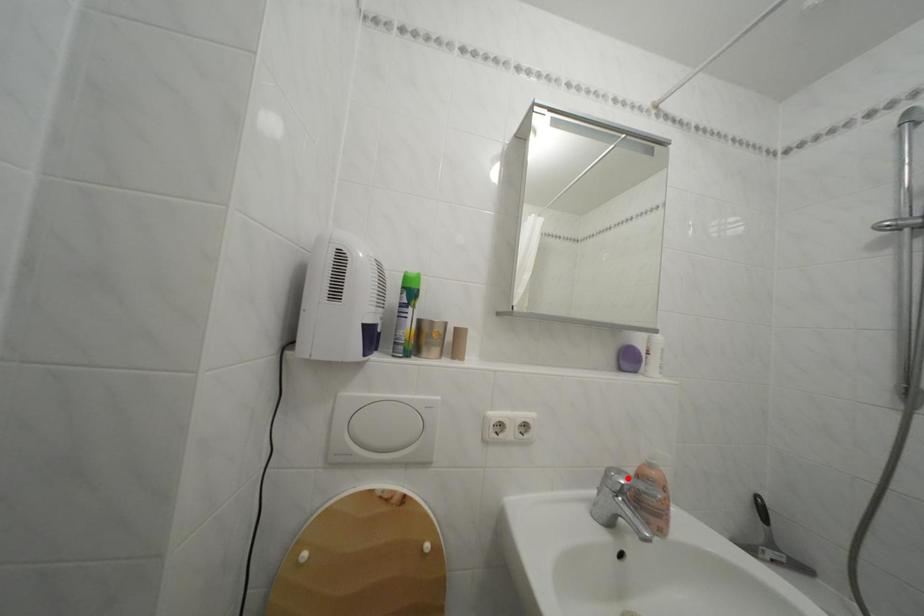
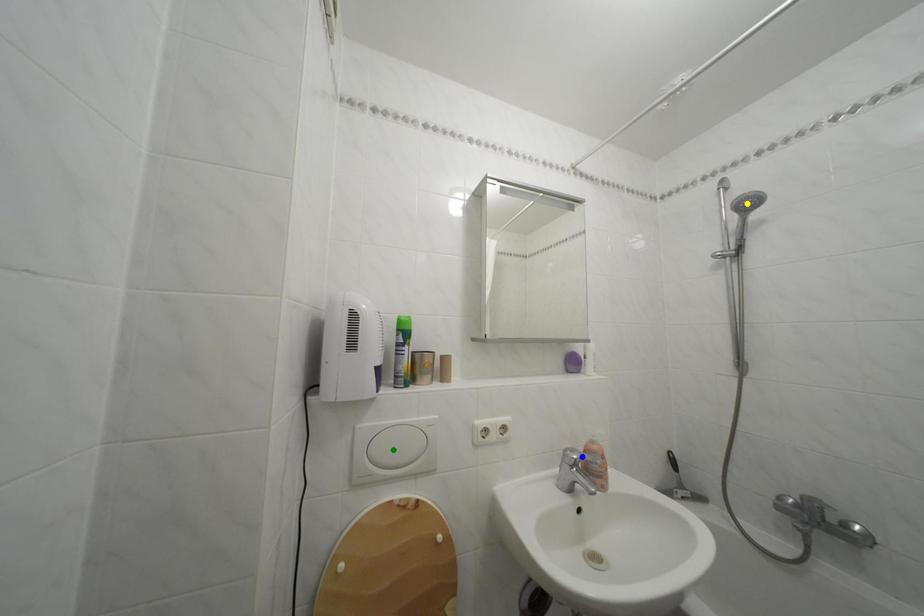
Question: I am providing you with two images of the same scene from different viewpoints. A red point is marked on the first image. You are given multiple points on the second image. In image 2, which mark is for the same physical point as the one in image 1?

Choices:
 (A) blue point
 (B) green point
 (C) yellow point

Answer: (A)